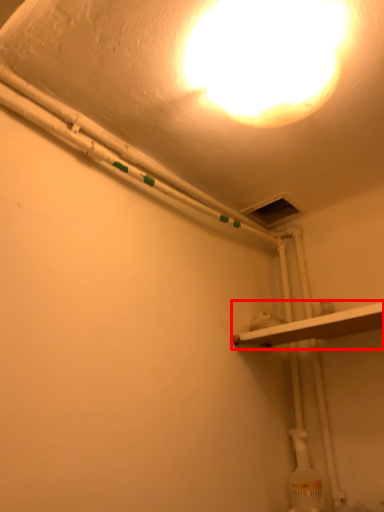
Question: Considering the relative positions of shelf (annotated by the red box) and lamp in the image provided, where is shelf (annotated by the red box) located with respect to the staircase?

Choices:
 (A) right
 (B) left

Answer: (A)